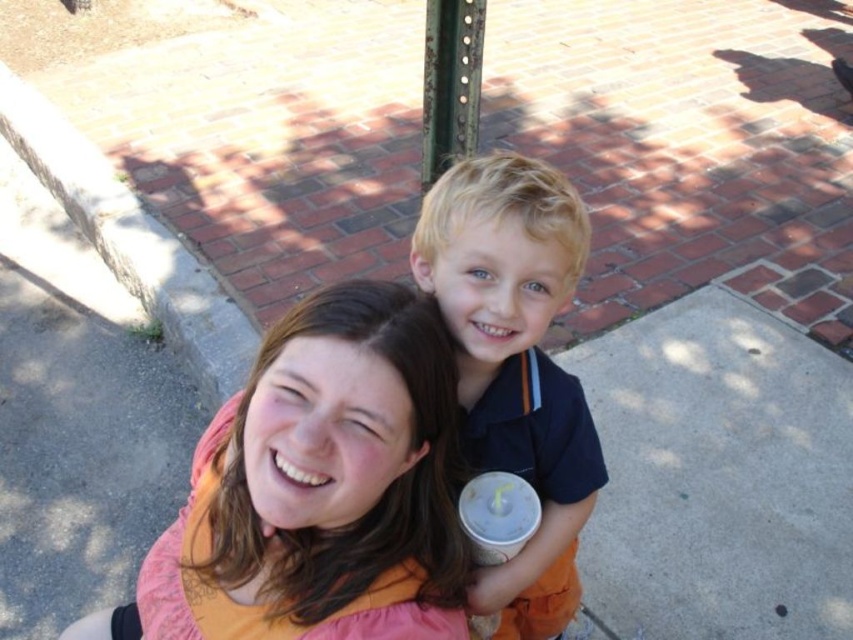
You are standing at the origin point in the scene. The coordinates of the matte orange shirt at center are given. Can you determine if the shirt is positioned to the right or left of the center point of the scene?

The coordinates of the matte orange shirt at center are at point 0.731 on the x axis and 0.390 on the y axis. Since the x coordinate is greater than 0.5, the shirt is positioned to the right of the center point of the scene.

You are a photographer trying to capture a clear photo of the white paper cup at center. However, the blonde hair boy at center is blocking your view. Can you move the cup to the side so it is no longer in front of the boy?

The blonde hair boy at center is closer to the viewer than the white paper cup at center, so moving the cup to the side would require adjusting its position relative to the boy to ensure it is no longer obstructed by him.

You are standing at the point labeled as point (x=509, y=496) and want to move towards the point labeled as point (x=267, y=381). Based on the scene, will you be moving forward or backward?

Since point (x=267, y=381) is in front of point (x=509, y=496), moving towards it would mean moving forward.